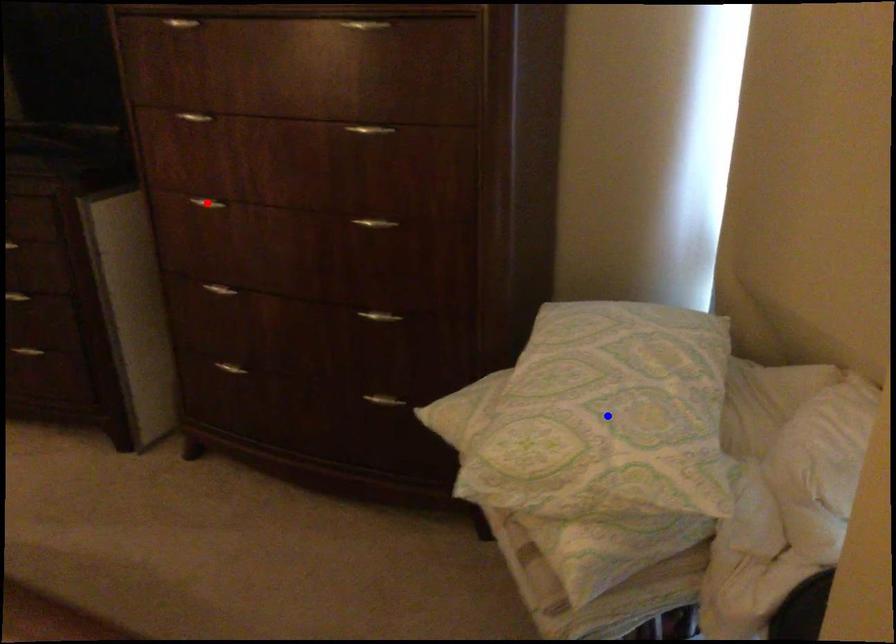
Question: Two points are marked on the image. Which point is closer to the camera?

Choices:
 (A) Blue point is closer.
 (B) Red point is closer.

Answer: (A)